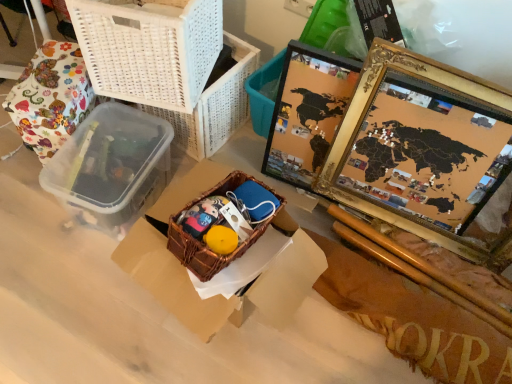
Find the location of a particular element. The height and width of the screenshot is (384, 512). vacant area in front of transparent plastic lunch box at left is located at coordinates (73, 287).